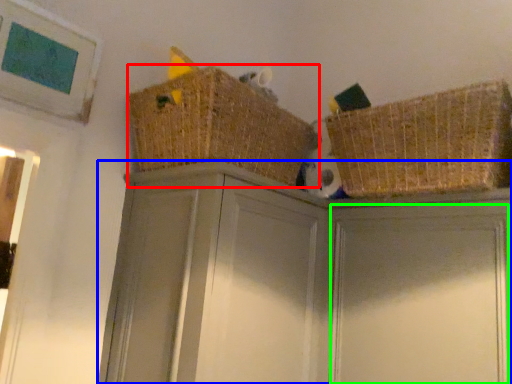
Question: Which object is positioned farthest from basket (highlighted by a red box)? Select from cabinetry (highlighted by a blue box) and door (highlighted by a green box).

Choices:
 (A) cabinetry
 (B) door

Answer: (B)